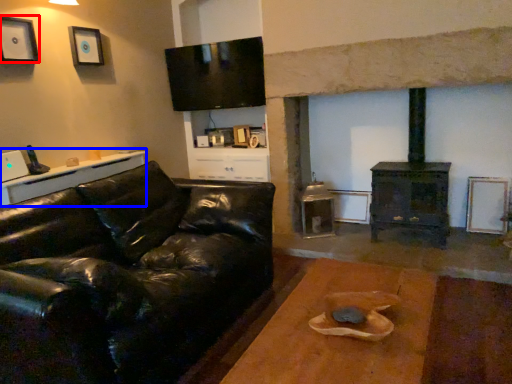
Question: Which object is closer to the camera taking this photo, picture frame (highlighted by a red box) or table (highlighted by a blue box)?

Choices:
 (A) picture frame
 (B) table

Answer: (B)